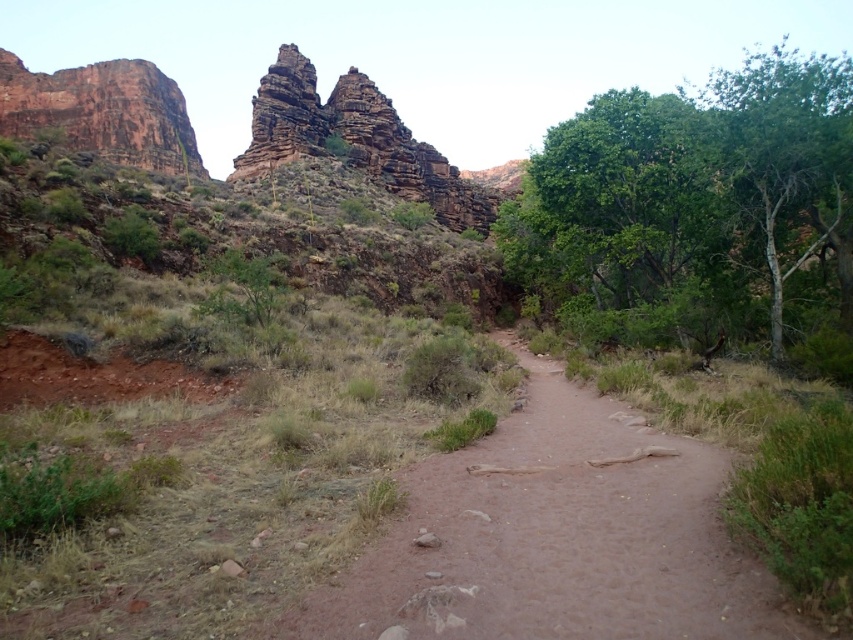
You are a hiker planning to cross the brown sandy dirt track at center. There is a green leafy tree at right nearby. Considering the width of the track, do you think you can safely pass through while keeping the tree on your right side?

The brown sandy dirt track at center has a lesser width compared to green leafy tree at right, so the track is narrower than the tree. Since the track is narrow, you might have limited space to maneuver while keeping the tree on your right side. It is advisable to proceed with caution to ensure safe passage.

You are a hiker planning to walk along the brown sandy dirt track at center and pass by the green leafy tree at right. Based on their sizes, which one do you think will be easier to navigate around?

The brown sandy dirt track at center has a smaller size compared to the green leafy tree at right, so it will be easier to navigate around the brown sandy dirt track at center since it takes up less space.